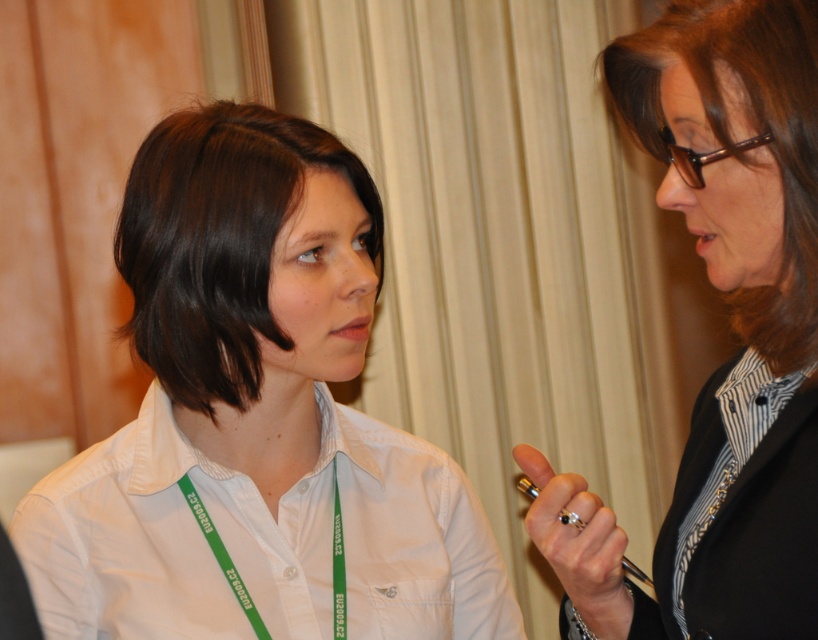
Question: From the image, what is the correct spatial relationship of white matte shirt at center in relation to white cotton shirt at center?

Choices:
 (A) below
 (B) above

Answer: (B)

Question: Which object is the farthest from the dark brown smooth hair at center?

Choices:
 (A) white cotton shirt at center
 (B) black glossy pen at upper right
 (C) green fabric lanyard at center
 (D) brown smooth hair at upper right

Answer: (C)

Question: Which point is closer to the camera taking this photo?

Choices:
 (A) (93, 588)
 (B) (464, 564)
 (C) (574, 572)
 (D) (789, 266)

Answer: (D)

Question: Is white matte shirt at center smaller than dark brown smooth hair at center?

Choices:
 (A) yes
 (B) no

Answer: (B)

Question: Which object is positioned farthest from the black glossy pen at upper right?

Choices:
 (A) dark brown smooth hair at center
 (B) white cotton shirt at center
 (C) white matte shirt at center
 (D) gold metallic pen at center

Answer: (A)

Question: Does white matte shirt at center have a lesser width compared to black glossy pen at upper right?

Choices:
 (A) no
 (B) yes

Answer: (A)